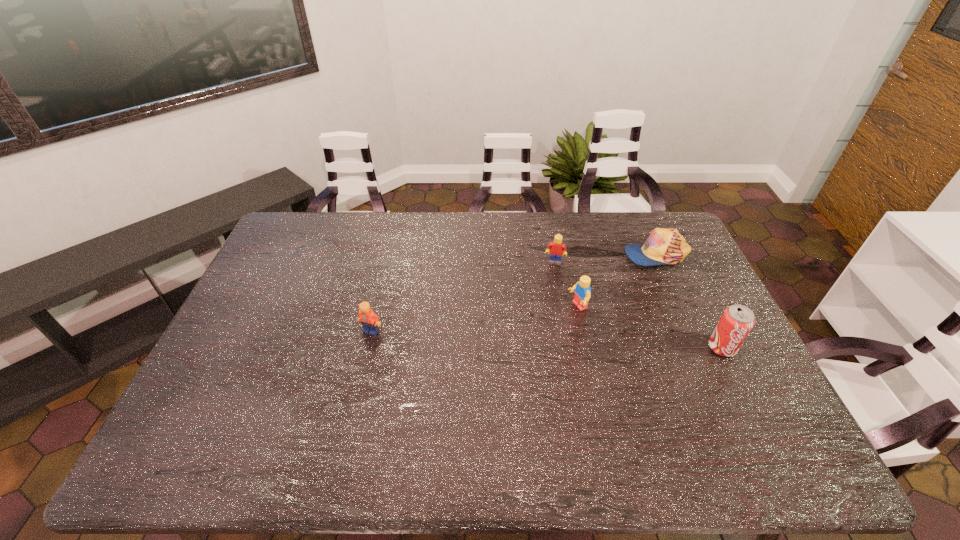
You are a GUI agent. You are given a task and a screenshot of the screen. Output one action in this format:
    pyautogui.click(x=<x>, y=<y>)
    Task: Click on the nearest Lego
    The width and height of the screenshot is (960, 540).
    Given the screenshot: What is the action you would take?
    pyautogui.click(x=369, y=320)

Locate an element on the screen. the second nearest object is located at coordinates (369, 320).

Identify the location of the nearest object. The image size is (960, 540). (736, 322).

You are a GUI agent. You are given a task and a screenshot of the screen. Output one action in this format:
    pyautogui.click(x=<x>, y=<y>)
    Task: Click on the tallest object
    
    Given the screenshot: What is the action you would take?
    pyautogui.click(x=736, y=322)

What are the coordinates of `the second nearest Lego` in the screenshot? It's located at (582, 295).

At what (x,y) coordinates should I click in order to perform the action: click on cap. Please return your answer as a coordinate pair (x, y). Looking at the image, I should click on (664, 246).

Where is `the farthest Lego`? This screenshot has height=540, width=960. the farthest Lego is located at coordinates (556, 248).

Where is `free spot located on the front-facing side of the nearest Lego`? free spot located on the front-facing side of the nearest Lego is located at coordinates (354, 404).

I want to click on free region located 0.130m on the left of the soda can, so click(662, 348).

Where is `vacant position located on the front-facing side of the third farthest object`? The height and width of the screenshot is (540, 960). vacant position located on the front-facing side of the third farthest object is located at coordinates pyautogui.click(x=467, y=353).